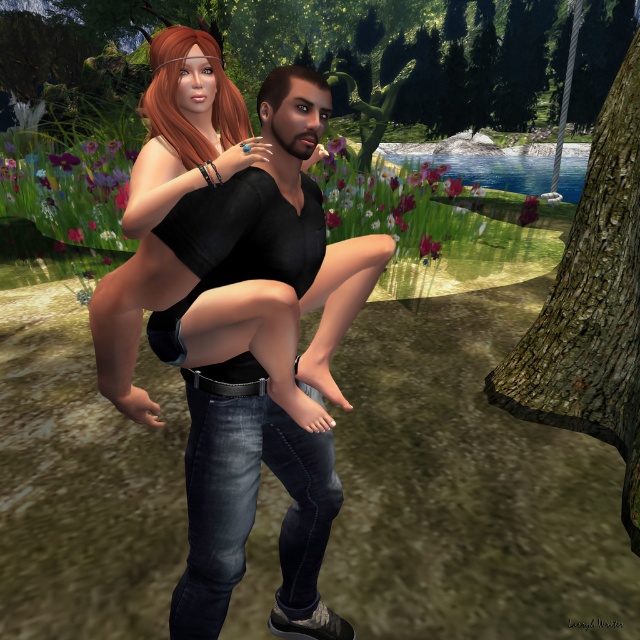
Question: Is matte black top at center further to the viewer compared to brown rough bark tree at right?

Choices:
 (A) yes
 (B) no

Answer: (B)

Question: In this image, where is matte black top at center located relative to brown rough bark tree at right?

Choices:
 (A) above
 (B) below

Answer: (B)

Question: Which of the following is the closest to the observer?

Choices:
 (A) matte black top at center
 (B) brown rough bark tree at right

Answer: (A)

Question: Can you confirm if matte black top at center is bigger than brown rough bark tree at right?

Choices:
 (A) no
 (B) yes

Answer: (A)

Question: Which of the following is the farthest from the observer?

Choices:
 (A) (593, 412)
 (B) (294, 572)

Answer: (A)